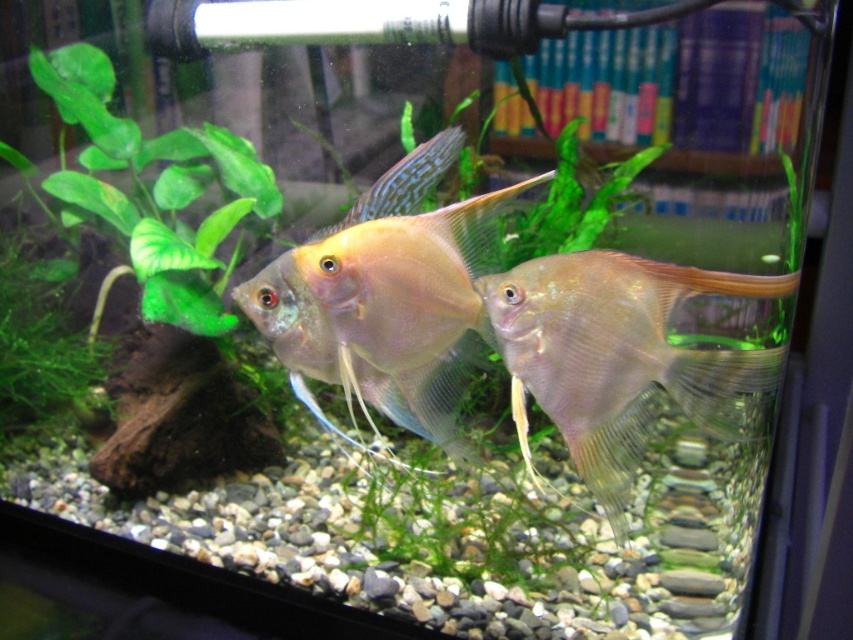
Question: Among these objects, which one is farthest from the camera?

Choices:
 (A) green leafy plant at left
 (B) translucent flesh-colored fish at center
 (C) translucent glass fish at center

Answer: (A)

Question: Estimate the real-world distances between objects in this image. Which object is closer to the translucent glass fish at center?

Choices:
 (A) translucent flesh-colored fish at center
 (B) green leafy plant at left

Answer: (A)

Question: Is translucent flesh-colored fish at center to the right of translucent glass fish at center from the viewer's perspective?

Choices:
 (A) yes
 (B) no

Answer: (A)

Question: Is translucent glass fish at center below green leafy plant at left?

Choices:
 (A) yes
 (B) no

Answer: (A)

Question: Can you confirm if translucent flesh-colored fish at center is positioned above green leafy plant at left?

Choices:
 (A) no
 (B) yes

Answer: (A)

Question: Which point is farther to the camera?

Choices:
 (A) (393, 394)
 (B) (131, 120)

Answer: (B)